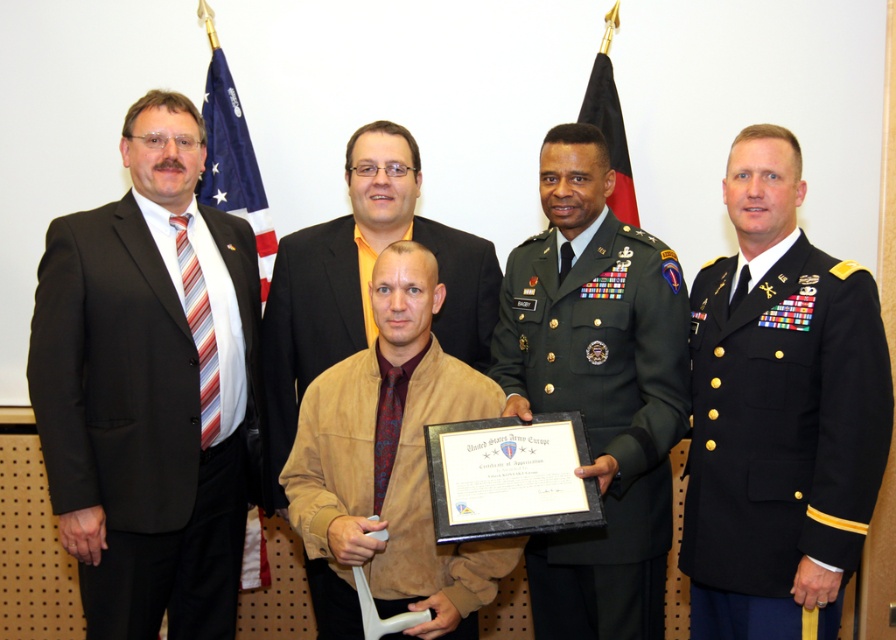
Is brown suede jacket at center closer to the viewer compared to blue fabric flag at left?

That is True.

Between point (312, 333) and point (205, 164), which one is positioned in front?

Point (312, 333) is more forward.

Where is `brown suede jacket at center`? brown suede jacket at center is located at coordinates (306, 330).

Is black wool military uniform at right positioned before suede jacket at center?

Yes, black wool military uniform at right is in front of suede jacket at center.

Is black wool military uniform at right smaller than suede jacket at center?

No.

Who is more distant from viewer, (745, 320) or (457, 582)?

Positioned behind is point (745, 320).

Where is `black wool military uniform at right`? black wool military uniform at right is located at coordinates (781, 436).

You are a GUI agent. You are given a task and a screenshot of the screen. Output one action in this format:
    pyautogui.click(x=<x>, y=<y>)
    Task: Click on the matte black suit at left
    The height and width of the screenshot is (640, 896).
    Given the screenshot: What is the action you would take?
    pyautogui.click(x=147, y=413)

Identify the location of matte black suit at left. Image resolution: width=896 pixels, height=640 pixels. (147, 413).